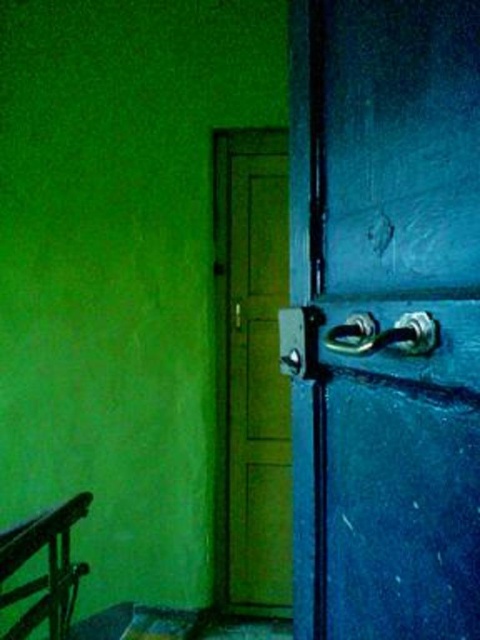
Who is positioned more to the left, green matte door at center or brushed metal balustrade at lower left?

brushed metal balustrade at lower left

Which is behind, point (230, 403) or point (71, 600)?

Point (230, 403)

The image size is (480, 640). What are the coordinates of `green matte door at center` in the screenshot? It's located at (252, 371).

Between point (476, 147) and point (22, 588), which one is positioned behind?

The point (22, 588) is behind.

Is blue matte door handle at center smaller than brushed metal balustrade at lower left?

No.

Measure the distance between blue matte door handle at center and camera.

blue matte door handle at center is 27.29 inches from camera.

Locate an element on the screen. The height and width of the screenshot is (640, 480). blue matte door handle at center is located at coordinates (384, 317).

Does blue matte door handle at center appear on the right side of green matte door at center?

Yes, blue matte door handle at center is to the right of green matte door at center.

Describe the element at coordinates (384, 317) in the screenshot. I see `blue matte door handle at center` at that location.

What are the coordinates of `blue matte door handle at center` in the screenshot? It's located at (384, 317).